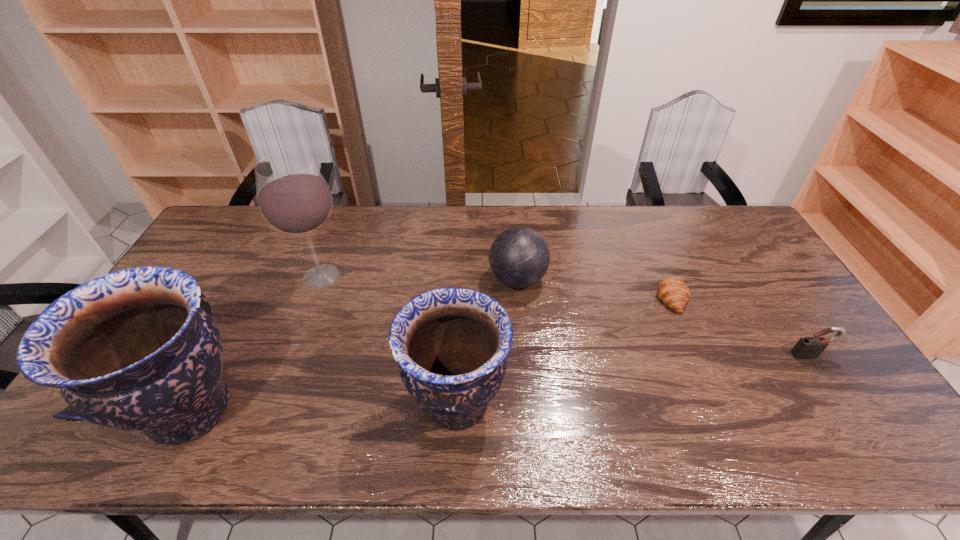
All potterys are currently evenly spaced. To continue this pattern, where would you add another pottery on the right? Please point out a vacant spot. Please provide its 2D coordinates. Your answer should be formatted as a tuple, i.e. [(x, y)], where the tuple contains the x and y coordinates of a point satisfying the conditions above.

[(715, 397)]